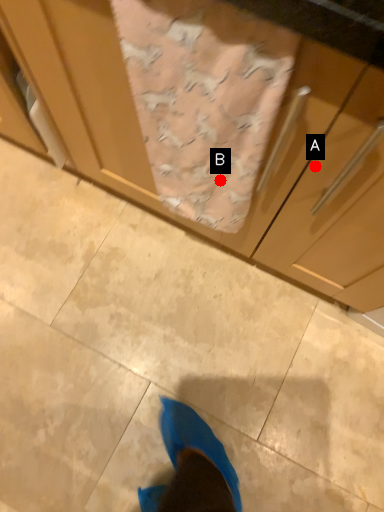
Question: Two points are circled on the image, labeled by A and B beside each circle. Which of the following is the closest to the observer?

Choices:
 (A) A is closer
 (B) B is closer

Answer: (A)